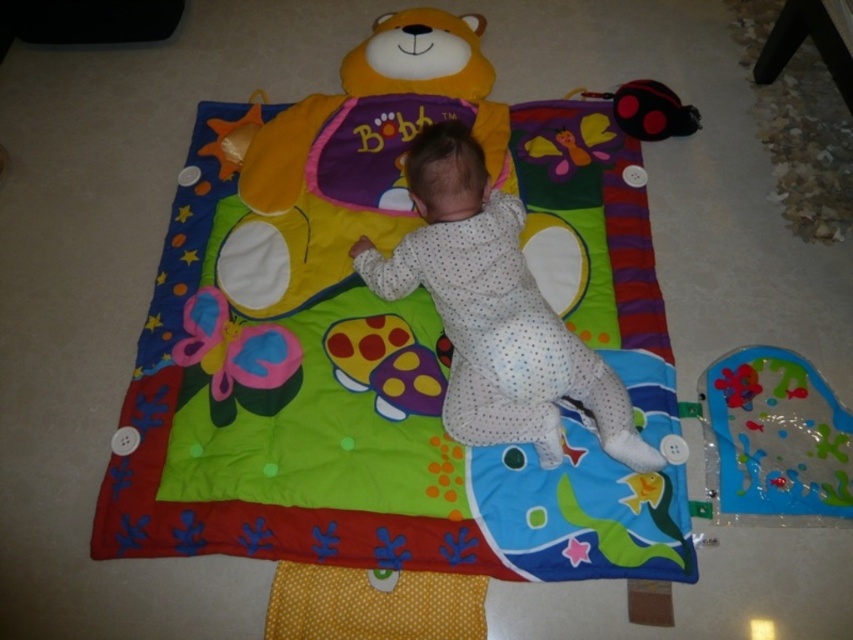
Question: Which of these objects is positioned farthest from the matte plastic mushroom at center?

Choices:
 (A) soft cotton play mat at center
 (B) white dotted fabric baby at center
 (C) matte plastic butterfly at center
 (D) black rubber toy at upper right

Answer: (D)

Question: Which object appears closest to the camera in this image?

Choices:
 (A) transparent plastic fish at lower right
 (B) soft cotton play mat at center

Answer: (B)

Question: Which point is closer to the camera taking this photo?

Choices:
 (A) (303, 323)
 (B) (355, 332)

Answer: (B)

Question: From the image, what is the correct spatial relationship of matte plastic butterfly at center in relation to black rubber toy at upper right?

Choices:
 (A) left
 (B) right

Answer: (A)

Question: Is soft cotton play mat at center smaller than white dotted fabric baby at center?

Choices:
 (A) yes
 (B) no

Answer: (B)

Question: From the image, what is the correct spatial relationship of soft cotton play mat at center in relation to transparent plastic fish at lower right?

Choices:
 (A) below
 (B) above

Answer: (B)